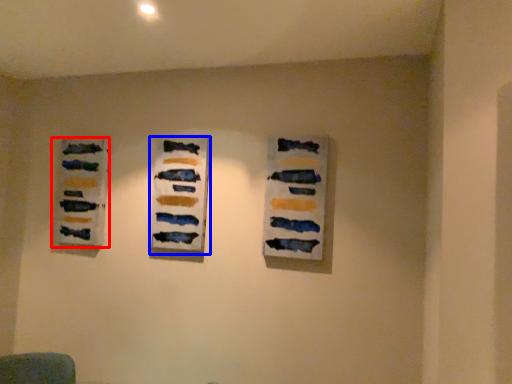
Question: Which point is closer to the camera, art exhibition (highlighted by a red box) or art exhibition (highlighted by a blue box)?

Choices:
 (A) art exhibition
 (B) art exhibition

Answer: (B)